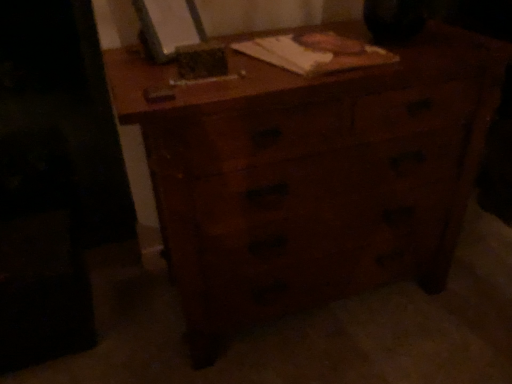
You are a GUI agent. You are given a task and a screenshot of the screen. Output one action in this format:
    pyautogui.click(x=<x>, y=<y>)
    Task: Click on the wooden notebook at center
    The width and height of the screenshot is (512, 384).
    Given the screenshot: What is the action you would take?
    pyautogui.click(x=315, y=52)

What do you see at coordinates (315, 52) in the screenshot?
I see `wooden notebook at center` at bounding box center [315, 52].

Describe the element at coordinates (310, 175) in the screenshot. I see `wooden chest of drawers at center` at that location.

The image size is (512, 384). I want to click on wooden chest of drawers at center, so pyautogui.click(x=310, y=175).

What are the coordinates of `wooden notebook at center` in the screenshot? It's located at (315, 52).

Would you say wooden chest of drawers at center is to the left or to the right of wooden notebook at center in the picture?

Clearly, wooden chest of drawers at center is on the right of wooden notebook at center in the image.

From the picture: In the image, is wooden chest of drawers at center positioned in front of or behind wooden notebook at center?

Clearly, wooden chest of drawers at center is in front of wooden notebook at center.

Does point (378, 67) appear closer or farther from the camera than point (310, 70)?

Point (378, 67).

From the image's perspective, which is below, wooden chest of drawers at center or wooden notebook at center?

wooden chest of drawers at center appears lower in the image.

From a real-world perspective, is wooden chest of drawers at center positioned over wooden notebook at center based on gravity?

No.

Looking at this image, does wooden chest of drawers at center have a lesser width compared to wooden notebook at center?

No, wooden chest of drawers at center is not thinner than wooden notebook at center.

Between wooden chest of drawers at center and wooden notebook at center, which one has more height?

Standing taller between the two is wooden chest of drawers at center.

Looking at the image, does wooden chest of drawers at center seem bigger or smaller compared to wooden notebook at center?

Clearly, wooden chest of drawers at center is larger in size than wooden notebook at center.

Is wooden chest of drawers at center located outside wooden notebook at center?

Indeed, wooden chest of drawers at center is completely outside wooden notebook at center.

Is wooden chest of drawers at center next to wooden notebook at center?

They are not placed beside each other.

Is wooden chest of drawers at center positioned with its back to wooden notebook at center?

wooden chest of drawers at center is not turned away from wooden notebook at center.

I want to click on the chest of drawers that is under the wooden notebook at center (from a real-world perspective), so click(x=310, y=175).

Between wooden notebook at center and wooden chest of drawers at center, which one appears on the right side from the viewer's perspective?

wooden chest of drawers at center.

Which object is further away from the camera taking this photo, wooden notebook at center or wooden chest of drawers at center?

Positioned behind is wooden notebook at center.

Which point is more distant from viewer, [355,50] or [203,187]?

The point [355,50] is farther.

From the image's perspective, is wooden notebook at center on wooden chest of drawers at center?

Correct, wooden notebook at center appears higher than wooden chest of drawers at center in the image.

From a real-world perspective, between wooden notebook at center and wooden chest of drawers at center, who is vertically higher?

In real-world perspective, wooden notebook at center is above.

In the scene shown: Is wooden notebook at center thinner than wooden chest of drawers at center?

Correct, the width of wooden notebook at center is less than that of wooden chest of drawers at center.

In the scene shown: Who is taller, wooden notebook at center or wooden chest of drawers at center?

wooden chest of drawers at center.

Based on the photo, can you confirm if wooden notebook at center is smaller than wooden chest of drawers at center?

Correct, wooden notebook at center occupies less space than wooden chest of drawers at center.

Is wooden notebook at center outside of wooden chest of drawers at center?

No.

Is wooden notebook at center directly adjacent to wooden chest of drawers at center?

wooden notebook at center is not next to wooden chest of drawers at center, and they're not touching.

Is wooden notebook at center looking in the opposite direction of wooden chest of drawers at center?

Yes.

Can you tell me how much wooden notebook at center and wooden chest of drawers at center differ in facing direction?

The angular difference between wooden notebook at center and wooden chest of drawers at center is 3.38 degrees.

Locate an element on the screen. This screenshot has height=384, width=512. notebook behind the wooden chest of drawers at center is located at coordinates (315, 52).

This screenshot has width=512, height=384. In order to click on notebook that is behind the wooden chest of drawers at center in this screenshot , I will do `click(315, 52)`.

Locate an element on the screen. This screenshot has width=512, height=384. notebook positioned vertically above the wooden chest of drawers at center (from a real-world perspective) is located at coordinates 315,52.